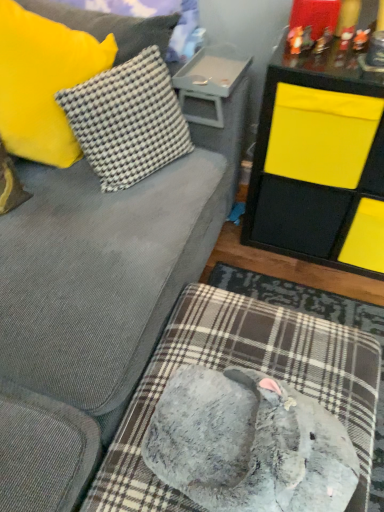
Question: Is the depth of gray plush dog bed at lower center greater than that of yellow fuzzy pillow at upper left, the 2th pillow positioned from the right?

Choices:
 (A) no
 (B) yes

Answer: (A)

Question: From a real-world perspective, is gray plush dog bed at lower center beneath yellow fuzzy pillow at upper left, the 1th pillow from the left?

Choices:
 (A) yes
 (B) no

Answer: (A)

Question: Can you confirm if gray plush dog bed at lower center is shorter than yellow fuzzy pillow at upper left, the 1th pillow from the left?

Choices:
 (A) no
 (B) yes

Answer: (B)

Question: Is gray plush dog bed at lower center smaller than yellow fuzzy pillow at upper left, the 2th pillow positioned from the right?

Choices:
 (A) yes
 (B) no

Answer: (B)

Question: Can you confirm if gray plush dog bed at lower center is wider than yellow fuzzy pillow at upper left, the 2th pillow positioned from the right?

Choices:
 (A) yes
 (B) no

Answer: (A)

Question: Considering the positions of white checkered fabric pillow at upper left, the second pillow viewed from the left, and yellow fuzzy pillow at upper left, the 1th pillow from the left, in the image, is white checkered fabric pillow at upper left, the second pillow viewed from the left, taller or shorter than yellow fuzzy pillow at upper left, the 1th pillow from the left,?

Choices:
 (A) short
 (B) tall

Answer: (A)

Question: Would you say white checkered fabric pillow at upper left, the 1th pillow positioned from the right, is inside or outside yellow fuzzy pillow at upper left, the 2th pillow positioned from the right?

Choices:
 (A) inside
 (B) outside

Answer: (A)

Question: In the image, is white checkered fabric pillow at upper left, the second pillow viewed from the left, positioned in front of or behind yellow fuzzy pillow at upper left, the 2th pillow positioned from the right?

Choices:
 (A) front
 (B) behind

Answer: (B)

Question: Considering the positions of white checkered fabric pillow at upper left, the 1th pillow positioned from the right, and yellow fuzzy pillow at upper left, the 2th pillow positioned from the right, in the image, is white checkered fabric pillow at upper left, the 1th pillow positioned from the right, wider or thinner than yellow fuzzy pillow at upper left, the 2th pillow positioned from the right,?

Choices:
 (A) thin
 (B) wide

Answer: (A)

Question: From a real-world perspective, relative to white checkered fabric pillow at upper left, the 1th pillow positioned from the right, is yellow fuzzy pillow at upper left, the 2th pillow positioned from the right, vertically above or below?

Choices:
 (A) above
 (B) below

Answer: (A)

Question: Considering the relative positions of yellow fuzzy pillow at upper left, the 2th pillow positioned from the right, and white checkered fabric pillow at upper left, the second pillow viewed from the left, in the image provided, is yellow fuzzy pillow at upper left, the 2th pillow positioned from the right, to the left or to the right of white checkered fabric pillow at upper left, the second pillow viewed from the left,?

Choices:
 (A) left
 (B) right

Answer: (A)

Question: Is yellow fuzzy pillow at upper left, the 2th pillow positioned from the right, taller or shorter than white checkered fabric pillow at upper left, the second pillow viewed from the left?

Choices:
 (A) tall
 (B) short

Answer: (A)

Question: Based on their sizes in the image, would you say yellow fuzzy pillow at upper left, the 2th pillow positioned from the right, is bigger or smaller than white checkered fabric pillow at upper left, the second pillow viewed from the left?

Choices:
 (A) big
 (B) small

Answer: (A)

Question: Relative to yellow matte storage unit at upper right, which is the second table in left-to-right order, is plastic tray at upper center, positioned as the first table in left-to-right order, in front or behind?

Choices:
 (A) front
 (B) behind

Answer: (B)

Question: Considering the positions of plastic tray at upper center, which is the second table from right to left, and yellow matte storage unit at upper right, placed as the first table when sorted from right to left, in the image, is plastic tray at upper center, which is the second table from right to left, taller or shorter than yellow matte storage unit at upper right, placed as the first table when sorted from right to left,?

Choices:
 (A) short
 (B) tall

Answer: (A)